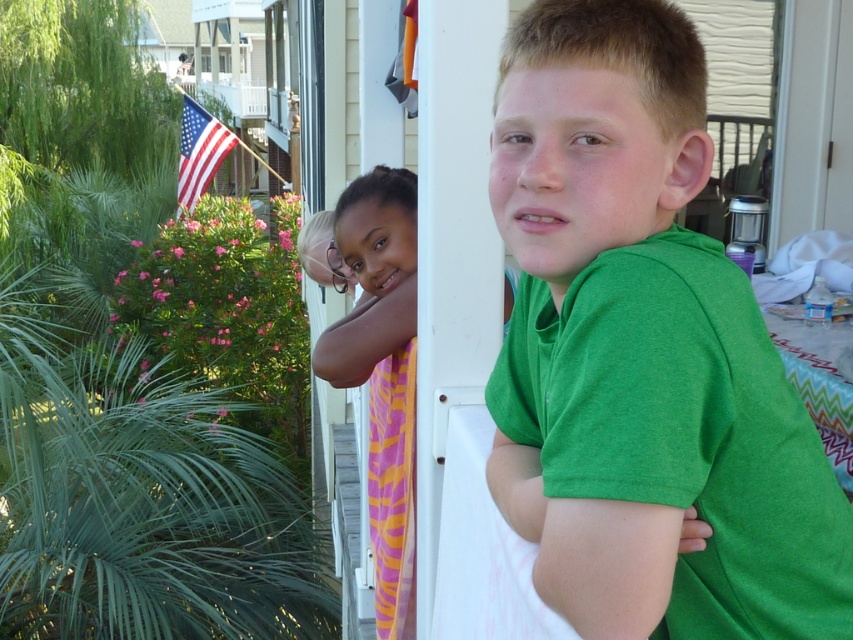
From the picture: You are a photographer trying to capture a closeup of the green cotton shirt at center. The camera you are using has a minimum focusing distance of 35 inches. Will you be able to take the photo without moving the shirt?

The green cotton shirt at center is 34.73 inches away from the camera, which is within the minimum focusing distance of 35 inches. Therefore, you can take the closeup photo without moving the shirt.

You are standing at the camera position and want to know how far the point at coordinates [631,381] is from you. Can you determine the distance?

The distance between the point at coordinates [631,381] and the camera is 36.11 inches.

You are a photographer trying to capture both the green cotton shirt at center and the matte green shirt at center in a clear photo. Which of the two shirts is more likely to be visible in the final image?

The green cotton shirt at center is more likely to be visible in the final image because it is in front of the matte green shirt at center.